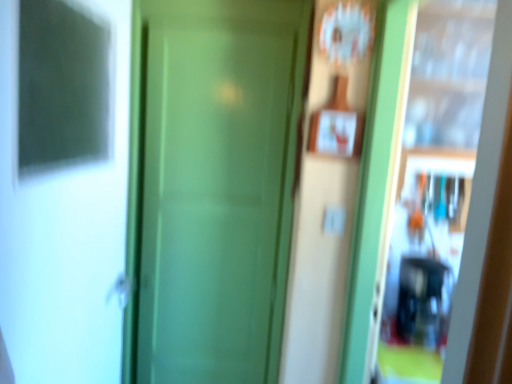
Question: From a real-world perspective, is green matte door at center positioned over white glossy screen door at left, the 1th screen door in the left-to-right sequence, based on gravity?

Choices:
 (A) no
 (B) yes

Answer: (A)

Question: Is green matte door at center bigger than white glossy screen door at left, the 1th screen door in the left-to-right sequence?

Choices:
 (A) no
 (B) yes

Answer: (A)

Question: From the image's perspective, does green matte door at center appear higher than white glossy screen door at left, positioned as the 2th screen door in right-to-left order?

Choices:
 (A) yes
 (B) no

Answer: (B)

Question: Could you tell me if green matte door at center is facing white glossy screen door at left, the 1th screen door in the left-to-right sequence?

Choices:
 (A) yes
 (B) no

Answer: (A)

Question: Are green matte door at center and white glossy screen door at left, positioned as the 2th screen door in right-to-left order, far apart?

Choices:
 (A) no
 (B) yes

Answer: (A)

Question: Is point (399, 291) closer or farther from the camera than point (156, 220)?

Choices:
 (A) farther
 (B) closer

Answer: (A)

Question: From a real-world perspective, relative to green matte door at center, is green matte screen door at center, positioned as the 1th screen door in right-to-left order, vertically above or below?

Choices:
 (A) below
 (B) above

Answer: (B)

Question: Is green matte screen door at center, positioned as the 1th screen door in right-to-left order, taller or shorter than green matte door at center?

Choices:
 (A) tall
 (B) short

Answer: (B)

Question: Based on their sizes in the image, would you say green matte screen door at center, the 2th screen door when ordered from left to right, is bigger or smaller than green matte door at center?

Choices:
 (A) big
 (B) small

Answer: (A)

Question: Considering the positions of point (389, 299) and point (88, 238), is point (389, 299) closer or farther from the camera than point (88, 238)?

Choices:
 (A) farther
 (B) closer

Answer: (A)

Question: Is green matte screen door at center, the 2th screen door when ordered from left to right, inside or outside of white glossy screen door at left, the 1th screen door in the left-to-right sequence?

Choices:
 (A) outside
 (B) inside

Answer: (A)

Question: In terms of height, does green matte screen door at center, the 2th screen door when ordered from left to right, look taller or shorter compared to white glossy screen door at left, positioned as the 2th screen door in right-to-left order?

Choices:
 (A) short
 (B) tall

Answer: (B)

Question: Looking at their shapes, would you say green matte screen door at center, positioned as the 1th screen door in right-to-left order, is wider or thinner than white glossy screen door at left, the 1th screen door in the left-to-right sequence?

Choices:
 (A) thin
 (B) wide

Answer: (B)

Question: Considering the positions of point (3, 122) and point (197, 67), is point (3, 122) closer or farther from the camera than point (197, 67)?

Choices:
 (A) farther
 (B) closer

Answer: (B)

Question: Do you think white glossy screen door at left, positioned as the 2th screen door in right-to-left order, is within green matte door at center, or outside of it?

Choices:
 (A) outside
 (B) inside

Answer: (A)